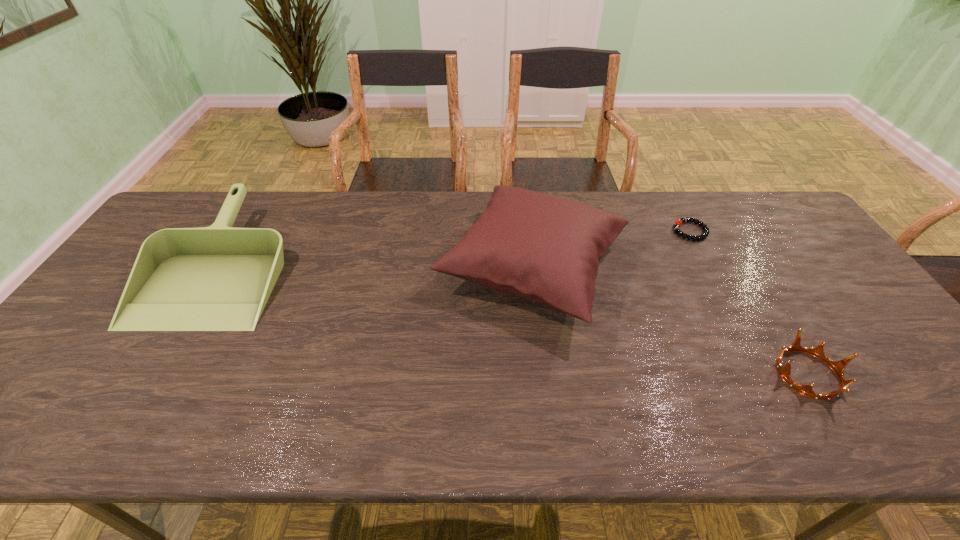
Locate an element on the screen. The width and height of the screenshot is (960, 540). the second object from left to right is located at coordinates (546, 249).

Find the location of a particular element. The height and width of the screenshot is (540, 960). the tallest object is located at coordinates (546, 249).

At what (x,y) coordinates should I click in order to perform the action: click on dustpan. Please return your answer as a coordinate pair (x, y). This screenshot has height=540, width=960. Looking at the image, I should click on (218, 278).

Image resolution: width=960 pixels, height=540 pixels. Identify the location of the third shortest object. (218, 278).

The height and width of the screenshot is (540, 960). In order to click on the third tallest object in this screenshot , I will do point(838,367).

You are a GUI agent. You are given a task and a screenshot of the screen. Output one action in this format:
    pyautogui.click(x=<x>, y=<y>)
    Task: Click on the bracelet
    The width and height of the screenshot is (960, 540).
    Given the screenshot: What is the action you would take?
    pyautogui.click(x=679, y=222)

At what (x,y) coordinates should I click in order to perform the action: click on blank space located on the left of the cushion. Please return your answer as a coordinate pair (x, y). The width and height of the screenshot is (960, 540). Looking at the image, I should click on (360, 267).

At what (x,y) coordinates should I click in order to perform the action: click on vacant space located on the scoop of the third shortest object. Please return your answer as a coordinate pair (x, y). This screenshot has height=540, width=960. Looking at the image, I should click on (156, 372).

Locate an element on the screen. The width and height of the screenshot is (960, 540). free location located on the back of the crown is located at coordinates (779, 326).

You are a GUI agent. You are given a task and a screenshot of the screen. Output one action in this format:
    pyautogui.click(x=<x>, y=<y>)
    Task: Click on the free spot located on the left of the shortest object
    Image resolution: width=960 pixels, height=540 pixels.
    Given the screenshot: What is the action you would take?
    pyautogui.click(x=590, y=231)